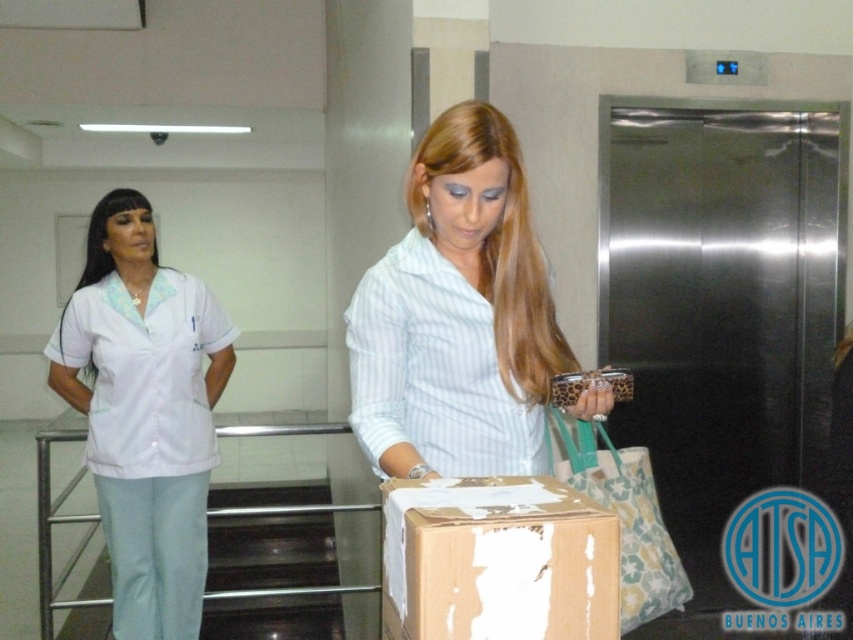
Does light blue striped shirt at center have a lesser height compared to brown cardboard box at center?

In fact, light blue striped shirt at center may be taller than brown cardboard box at center.

Does point (439, 202) come closer to viewer compared to point (463, 561)?

No, it is not.

You are a GUI agent. You are given a task and a screenshot of the screen. Output one action in this format:
    pyautogui.click(x=<x>, y=<y>)
    Task: Click on the light blue striped shirt at center
    
    Given the screenshot: What is the action you would take?
    pyautogui.click(x=457, y=316)

Is light blue striped shirt at center shorter than patterned fabric shopping bag at center?

No.

Is light blue striped shirt at center below patterned fabric shopping bag at center?

Incorrect, light blue striped shirt at center is not positioned below patterned fabric shopping bag at center.

Is point (502, 422) closer to viewer compared to point (635, 524)?

Yes, point (502, 422) is in front of point (635, 524).

What are the coordinates of `light blue striped shirt at center` in the screenshot? It's located at (457, 316).

Who is lower down, brown cardboard box at center or patterned fabric shopping bag at center?

Positioned lower is patterned fabric shopping bag at center.

Does brown cardboard box at center appear on the right side of patterned fabric shopping bag at center?

In fact, brown cardboard box at center is to the left of patterned fabric shopping bag at center.

This screenshot has height=640, width=853. Describe the element at coordinates (497, 561) in the screenshot. I see `brown cardboard box at center` at that location.

Where is `brown cardboard box at center`? The image size is (853, 640). brown cardboard box at center is located at coordinates (497, 561).